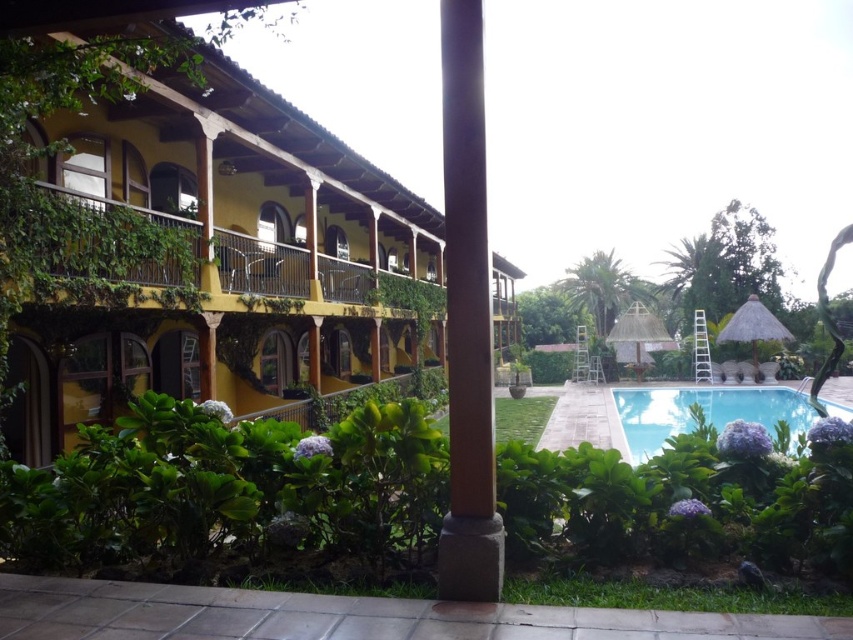
Question: Which of the following is the farthest from the observer?

Choices:
 (A) clear blue water at center
 (B) green leafy bush at center
 (C) yellow matte building at upper left
 (D) brown stone pillar at center

Answer: (A)

Question: Can you confirm if green leafy bush at center is wider than brown stone pillar at center?

Choices:
 (A) yes
 (B) no

Answer: (A)

Question: Which of the following is the farthest from the observer?

Choices:
 (A) (703, 406)
 (B) (459, 172)

Answer: (A)

Question: Is green leafy bush at center closer to the viewer compared to brown stone pillar at center?

Choices:
 (A) no
 (B) yes

Answer: (A)

Question: From the image, what is the correct spatial relationship of yellow matte building at upper left in relation to brown stone pillar at center?

Choices:
 (A) above
 (B) below

Answer: (B)

Question: Which point appears closest to the camera in this image?

Choices:
 (A) (834, 406)
 (B) (323, 310)
 (C) (450, 548)
 (D) (115, 540)

Answer: (C)